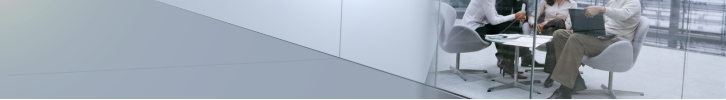
Identify the location of papers. [512, 34], [520, 39].